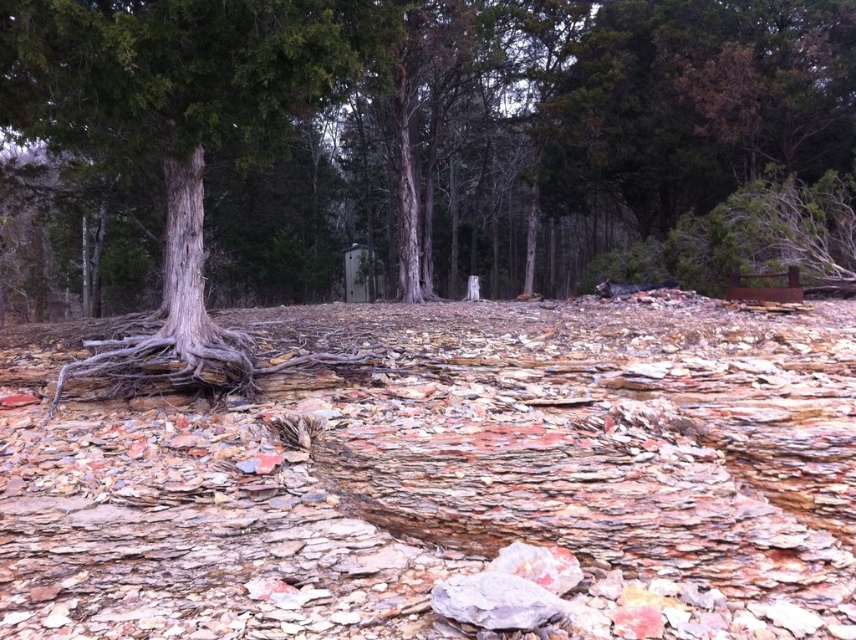
Consider the image. Which of these two, rusty stone rock at center or gray textured tree trunk at left, stands taller?

Standing taller between the two is gray textured tree trunk at left.

Is rusty stone rock at center positioned before gray textured tree trunk at left?

Yes.

Describe the element at coordinates (446, 476) in the screenshot. I see `rusty stone rock at center` at that location.

Locate an element on the screen. rusty stone rock at center is located at coordinates (446, 476).